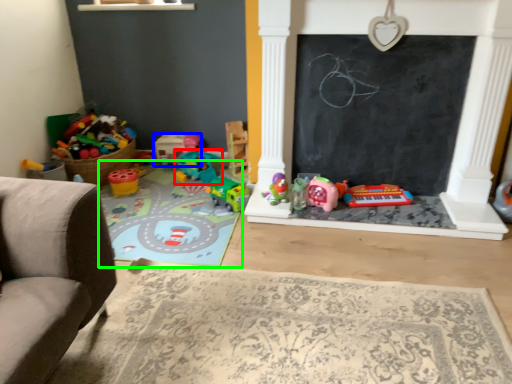
Question: Considering the real-world distances, which object is farthest from toy (highlighted by a red box)? toy (highlighted by a blue box) or mat (highlighted by a green box)?

Choices:
 (A) toy
 (B) mat

Answer: (B)